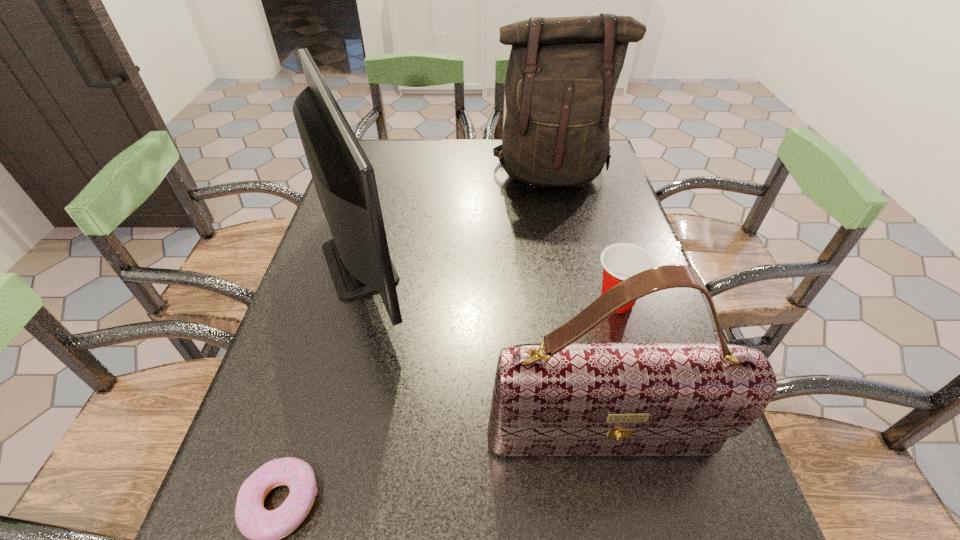
You are a GUI agent. You are given a task and a screenshot of the screen. Output one action in this format:
    pyautogui.click(x=<x>, y=<y>)
    Task: Click on the backpack
    
    Given the screenshot: What is the action you would take?
    pyautogui.click(x=562, y=73)

Locate an element on the screen. The height and width of the screenshot is (540, 960). computer monitor is located at coordinates (358, 258).

Where is `handbag`? handbag is located at coordinates tap(557, 398).

Where is `the second shortest object`? This screenshot has height=540, width=960. the second shortest object is located at coordinates (620, 261).

You are a GUI agent. You are given a task and a screenshot of the screen. Output one action in this format:
    pyautogui.click(x=<x>, y=<y>)
    Task: Click on the vacant region located 0.070m on the open flap of the backpack
    Image resolution: width=960 pixels, height=540 pixels.
    Given the screenshot: What is the action you would take?
    [560, 212]

The width and height of the screenshot is (960, 540). What are the coordinates of `free space located 0.310m on the front-facing side of the computer monitor` in the screenshot? It's located at click(546, 261).

Where is `free location located 0.080m on the front of the handbag with the clasp`? This screenshot has width=960, height=540. free location located 0.080m on the front of the handbag with the clasp is located at coordinates (617, 523).

Where is `blank area located on the left of the cup`? The height and width of the screenshot is (540, 960). blank area located on the left of the cup is located at coordinates (433, 301).

The width and height of the screenshot is (960, 540). Find the location of `object located at the far edge`. object located at the far edge is located at coordinates (562, 73).

Where is `object present at the left edge`? The image size is (960, 540). object present at the left edge is located at coordinates (358, 258).